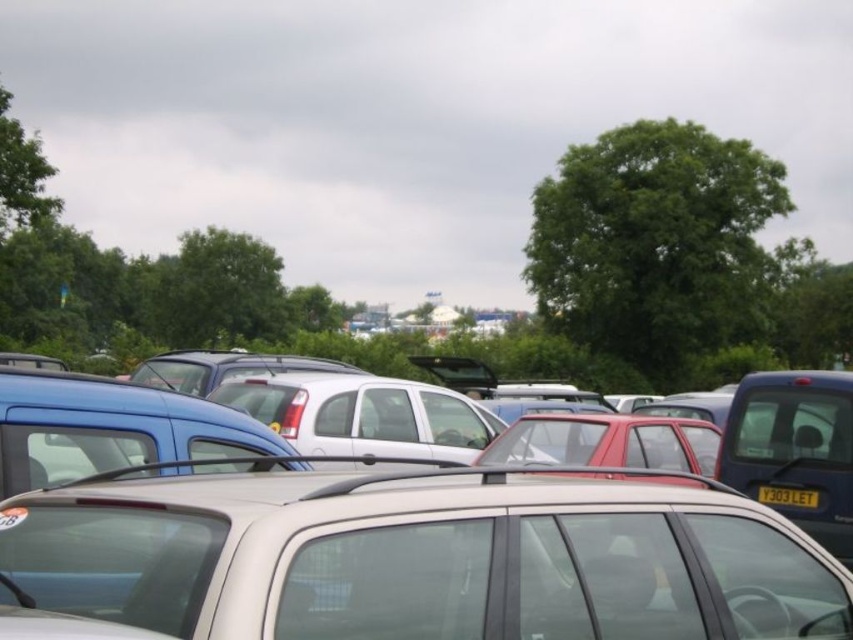
You are standing in the parking lot and see the point marked at coordinates (421, 557). What object is located at that point?

→ The point at coordinates (421, 557) corresponds to the satin silver car at center.

You are a parking attendant who needs to fit a new car into the parking lot. The new car is the same height as the yellow matte license plate at center. Can the new car fit between the satin silver car at center and the blue car to its left?

The satin silver car at center is much taller than the yellow matte license plate at center, which means the new car, being the same height as the license plate, is shorter than the satin silver car. However, the description does not provide information about the height of the blue car or the available space between the two cars. Therefore, it is unclear if the new car can fit in that specific spot without additional details about the blue car or the space between them.

You are a parking attendant checking the vehicles in the parking lot. You notice the satin silver car at center and the yellow matte license plate at center. Which object is bigger in size?

The satin silver car at center is larger in size compared to the yellow matte license plate at center.